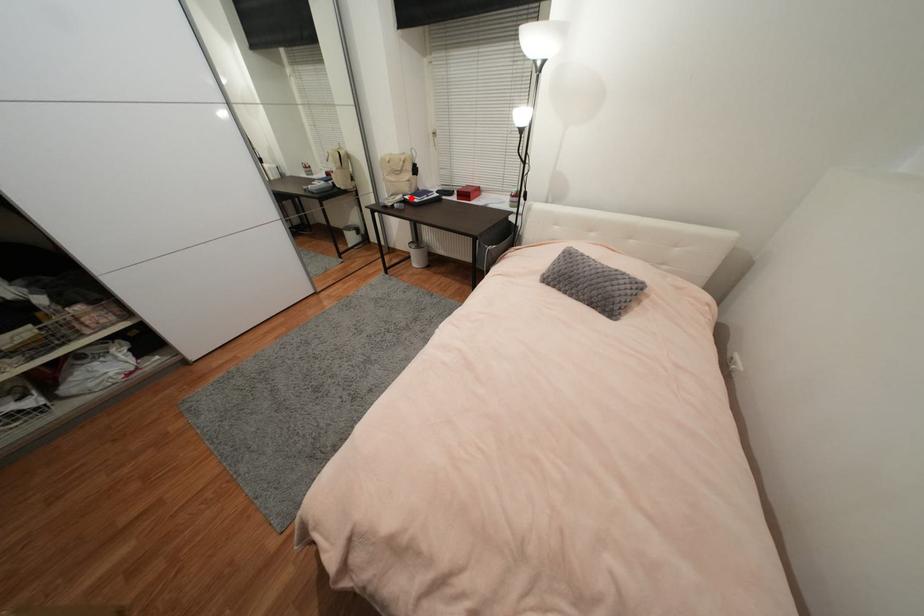
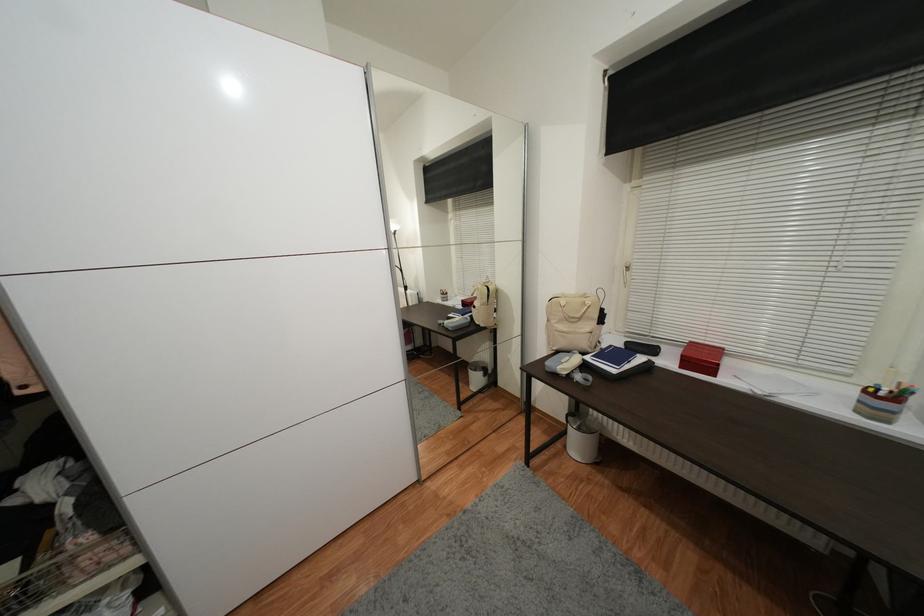
The point at the highlighted location is marked in the first image. Where is the corresponding point in the second image?

(592, 360)